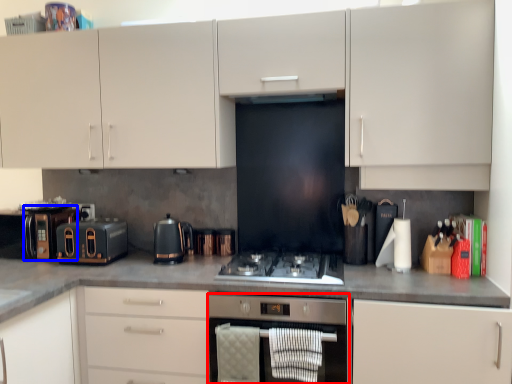
Question: Which object appears closest to the camera in this image, home appliance (highlighted by a red box) or appliance (highlighted by a blue box)?

Choices:
 (A) home appliance
 (B) appliance

Answer: (A)